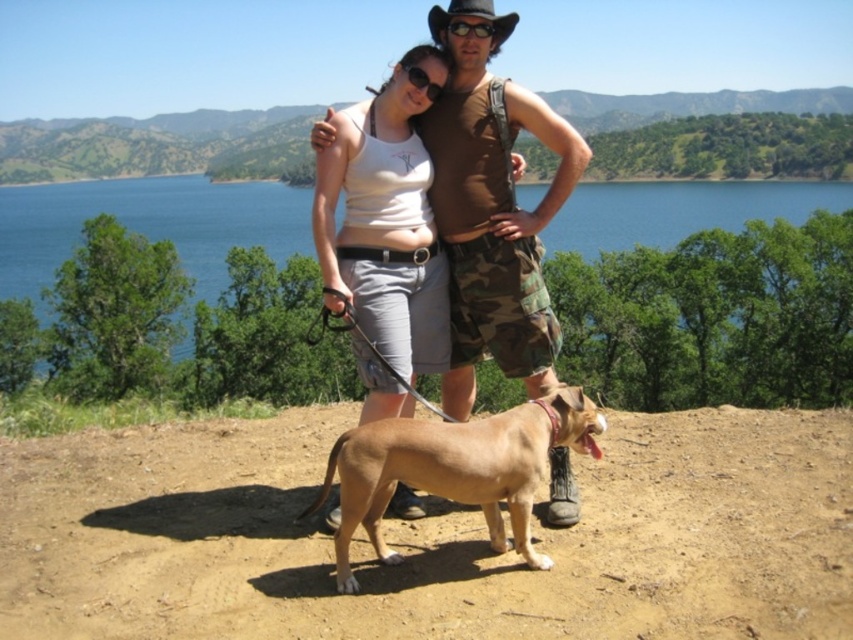
You are standing at the dirt path where the man and woman are located. You want to walk straight towards the blue water at center. What direction should you walk in?

Since the blue water at center is located at point 0.352 on the x axis and 0.175 on the y axis, you should walk towards the center of the image to reach it.

Consider the image. Based on the coordinates provided, which object is located at point (492, 211)?

The brown camouflage shorts at center is located at point (492, 211).